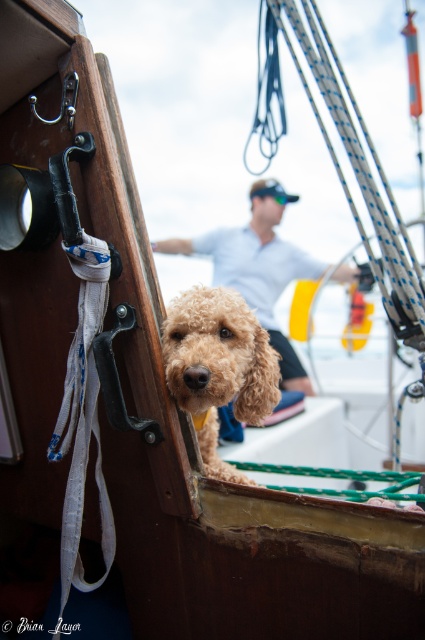
You are a photographer on a sailboat and want to capture the fuzzy golden dog at center and the white cotton shirt at center in the same frame. Which object should you zoom in on to ensure both fit in the shot?

The fuzzy golden dog at center is thinner than the white cotton shirt at center, so you should zoom out to include both objects in the frame.

You are a passenger on the boat and want to reach the white cotton shirt at center without disturbing the fuzzy golden dog at center. Is the dog in your way?

The fuzzy golden dog at center is closer to the viewer than the white cotton shirt at center, so the dog is blocking the path to the shirt. You would need to move the dog to access the shirt.

You are a sailor on the boat and need to secure the white rope to the cabin edge near the fuzzy golden dog at center. Where exactly should you attach it?

The white rope should be attached near the position of the fuzzy golden dog at center, which is located at coordinates point (x=218, y=365).